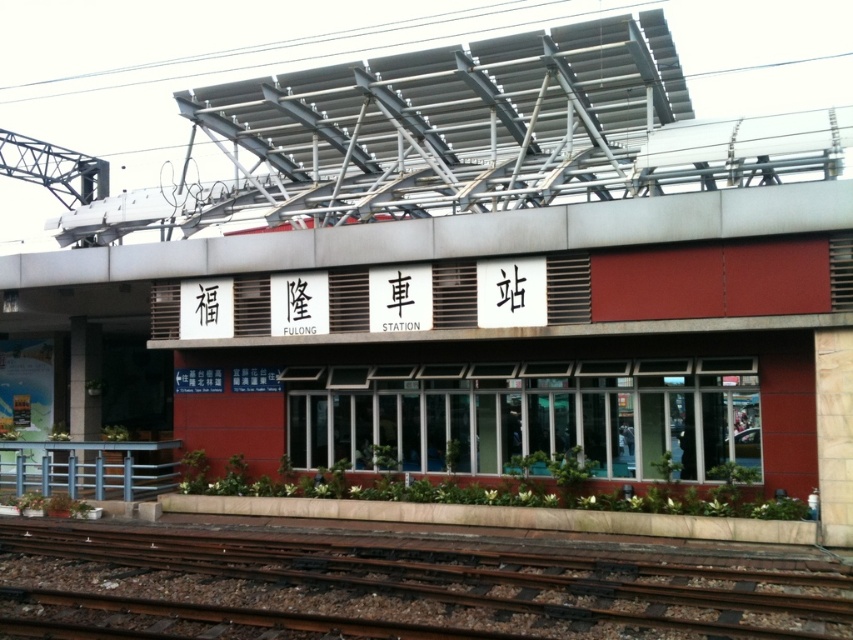
You are standing at Fulong Station and want to cross the rusty metal train track at bottom safely. There is a blue painted metal railing at lower left nearby. Which direction should you walk to reach the railing before crossing the tracks?

You should walk to the left to reach the blue painted metal railing at lower left before crossing the rusty metal train track at bottom, since the track is to the right of the railing.

You are a photographer standing at the entrance of Fulong Station. You want to capture a photo that includes both the rusty metal train track at bottom and the blue painted metal railing at lower left. Which object should you frame first in your camera viewfinder to ensure both are fully visible?

The rusty metal train track at bottom is shorter than the blue painted metal railing at lower left, so you should frame the longer blue painted metal railing at lower left first to ensure both objects fit within the frame.